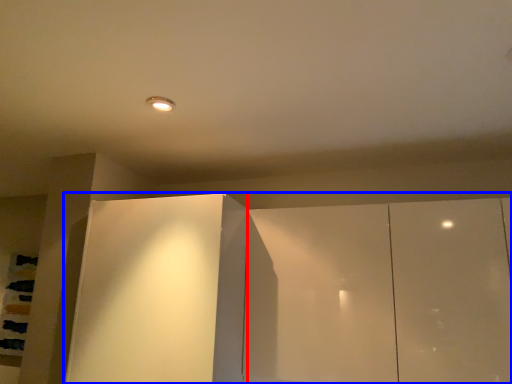
Question: Among these objects, which one is farthest to the camera, glass door (highlighted by a red box) or cupboard (highlighted by a blue box)?

Choices:
 (A) glass door
 (B) cupboard

Answer: (A)